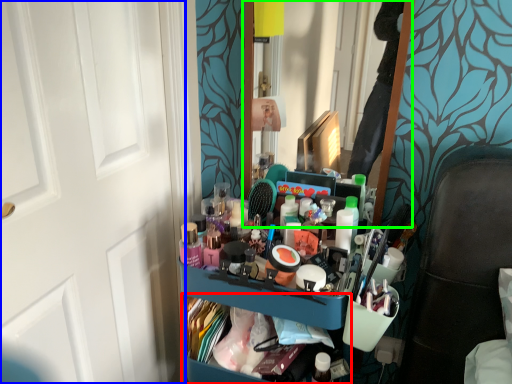
Question: Which object is positioned closest to cabinet (highlighted by a red box)? Select from door (highlighted by a blue box) and mirror (highlighted by a green box).

Choices:
 (A) door
 (B) mirror

Answer: (A)